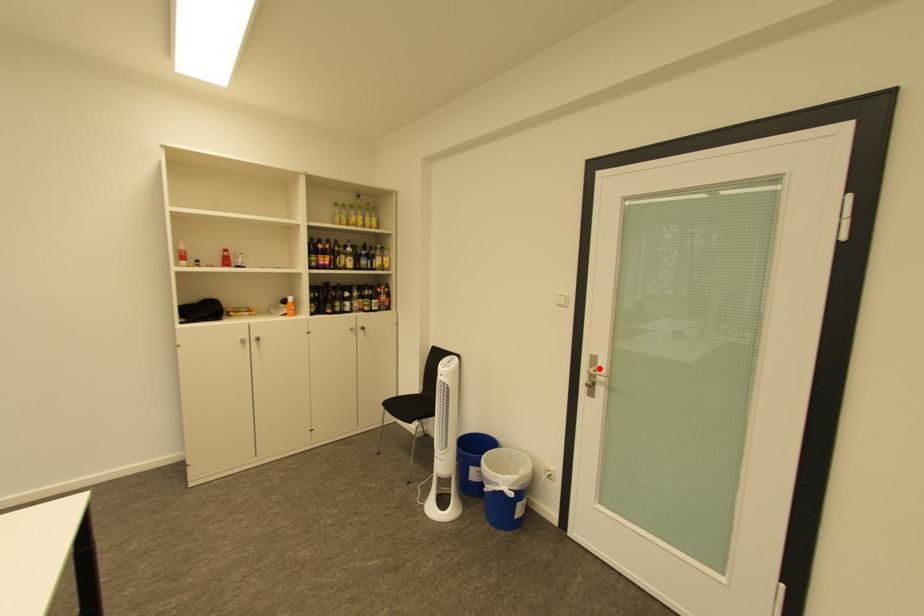
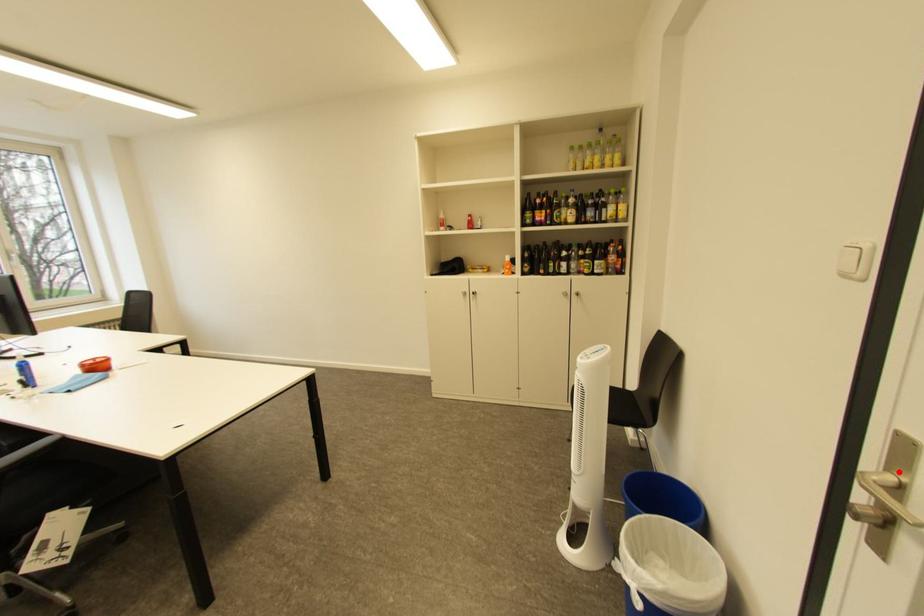
I am providing you with two images of the same scene from different viewpoints. A red point is marked on the first image and another point is marked on the second image. Is the marked point in image1 the same physical position as the marked point in image2?

Yes